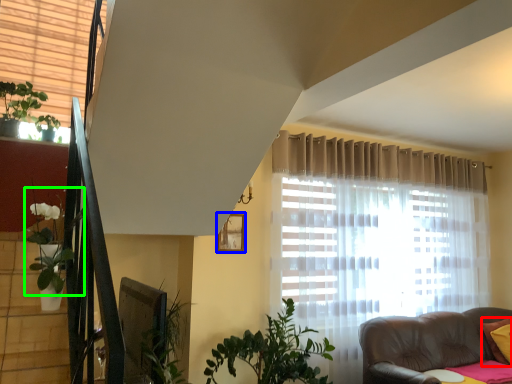
Question: Which is nearer to the pillow (highlighted by a red box)? picture frame (highlighted by a blue box) or plant (highlighted by a green box).

Choices:
 (A) picture frame
 (B) plant

Answer: (A)